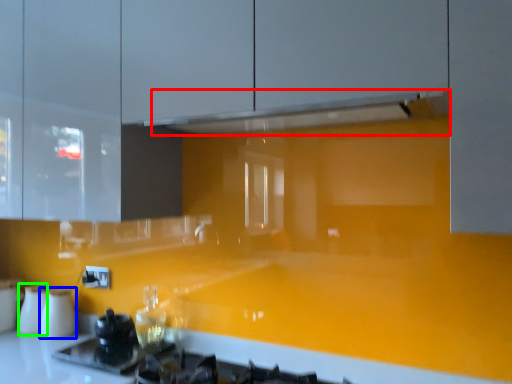
Question: Considering the real-world distances, which object is farthest from exhaust hood (highlighted by a red box)? appliance (highlighted by a blue box) or appliance (highlighted by a green box)?

Choices:
 (A) appliance
 (B) appliance

Answer: (B)